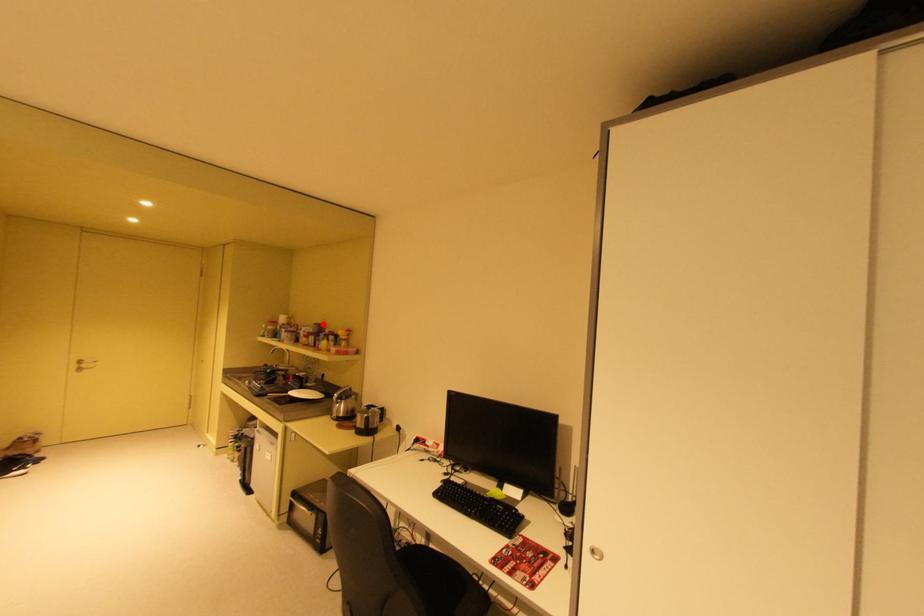
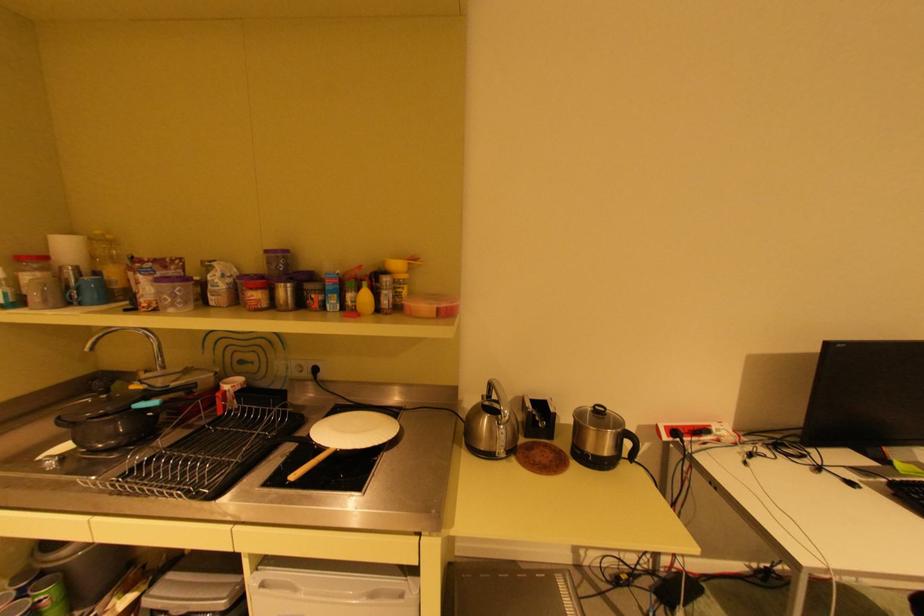
Find the pixel in the second image that matches the highlighted location in the first image.

(274, 251)